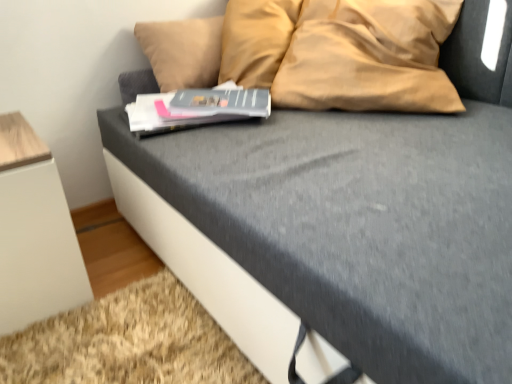
Question: Considering the relative sizes of hardcover book at center, which is the 1th paperback book from front to back, and matte gray paperback book at center, marked as the 2th paperback book in a front-to-back arrangement, in the image provided, is hardcover book at center, which is the 1th paperback book from front to back, thinner than matte gray paperback book at center, marked as the 2th paperback book in a front-to-back arrangement,?

Choices:
 (A) yes
 (B) no

Answer: (B)

Question: From the image's perspective, does hardcover book at center, arranged as the second paperback book when viewed from the back, appear lower than matte gray paperback book at center, marked as the 2th paperback book in a front-to-back arrangement?

Choices:
 (A) yes
 (B) no

Answer: (A)

Question: Is hardcover book at center, which is the 1th paperback book from front to back, located outside matte gray paperback book at center, marked as the 2th paperback book in a front-to-back arrangement?

Choices:
 (A) no
 (B) yes

Answer: (B)

Question: Does hardcover book at center, which is the 1th paperback book from front to back, lie behind matte gray paperback book at center, marked as the 2th paperback book in a front-to-back arrangement?

Choices:
 (A) no
 (B) yes

Answer: (A)

Question: Does hardcover book at center, arranged as the second paperback book when viewed from the back, contain matte gray paperback book at center, arranged as the 1th paperback book when viewed from the back?

Choices:
 (A) no
 (B) yes

Answer: (B)

Question: Do you think hardcover book at center, which is the 1th paperback book from front to back, is within white matte cabinet at lower left, or outside of it?

Choices:
 (A) inside
 (B) outside

Answer: (B)

Question: Considering the positions of point (254, 110) and point (16, 314), is point (254, 110) closer or farther from the camera than point (16, 314)?

Choices:
 (A) closer
 (B) farther

Answer: (B)

Question: In terms of height, does hardcover book at center, which is the 1th paperback book from front to back, look taller or shorter compared to white matte cabinet at lower left?

Choices:
 (A) short
 (B) tall

Answer: (A)

Question: Considering the positions of hardcover book at center, which is the 1th paperback book from front to back, and white matte cabinet at lower left in the image, is hardcover book at center, which is the 1th paperback book from front to back, bigger or smaller than white matte cabinet at lower left?

Choices:
 (A) big
 (B) small

Answer: (B)

Question: Is hardcover book at center, which is the 1th paperback book from front to back, to the left or to the right of matte gray paperback book at center, marked as the 2th paperback book in a front-to-back arrangement, in the image?

Choices:
 (A) left
 (B) right

Answer: (A)

Question: From the image's perspective, is hardcover book at center, which is the 1th paperback book from front to back, located above or below matte gray paperback book at center, arranged as the 1th paperback book when viewed from the back?

Choices:
 (A) above
 (B) below

Answer: (B)

Question: From a real-world perspective, is hardcover book at center, arranged as the second paperback book when viewed from the back, physically located above or below matte gray paperback book at center, arranged as the 1th paperback book when viewed from the back?

Choices:
 (A) above
 (B) below

Answer: (B)

Question: Is hardcover book at center, which is the 1th paperback book from front to back, inside or outside of matte gray paperback book at center, marked as the 2th paperback book in a front-to-back arrangement?

Choices:
 (A) outside
 (B) inside

Answer: (A)

Question: From a real-world perspective, is matte gray paperback book at center, marked as the 2th paperback book in a front-to-back arrangement, above or below white matte cabinet at lower left?

Choices:
 (A) below
 (B) above

Answer: (B)

Question: From the image's perspective, relative to white matte cabinet at lower left, is matte gray paperback book at center, arranged as the 1th paperback book when viewed from the back, above or below?

Choices:
 (A) above
 (B) below

Answer: (A)